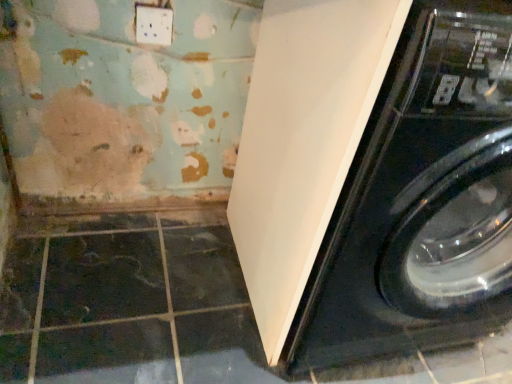
Where is `white plastic electric outlet at upper center`? This screenshot has width=512, height=384. white plastic electric outlet at upper center is located at coordinates (153, 25).

What do you see at coordinates (153, 25) in the screenshot? I see `white plastic electric outlet at upper center` at bounding box center [153, 25].

Locate an element on the screen. This screenshot has height=384, width=512. white glossy washing machine at lower right is located at coordinates (376, 178).

Describe the element at coordinates (376, 178) in the screenshot. I see `white glossy washing machine at lower right` at that location.

The width and height of the screenshot is (512, 384). What are the coordinates of `white plastic electric outlet at upper center` in the screenshot? It's located at (153, 25).

In the image, is white glossy washing machine at lower right on the left side or the right side of white plastic electric outlet at upper center?

white glossy washing machine at lower right is to the right of white plastic electric outlet at upper center.

Considering the positions of objects white glossy washing machine at lower right and white plastic electric outlet at upper center in the image provided, who is behind, white glossy washing machine at lower right or white plastic electric outlet at upper center?

white plastic electric outlet at upper center is further away from the camera.

Is point (282, 287) farther from viewer compared to point (161, 26)?

No, it is in front of (161, 26).

From the image's perspective, is white glossy washing machine at lower right beneath white plastic electric outlet at upper center?

Correct, white glossy washing machine at lower right appears lower than white plastic electric outlet at upper center in the image.

From a real-world perspective, which object rests below the other?

white glossy washing machine at lower right is physically lower.

Between white glossy washing machine at lower right and white plastic electric outlet at upper center, which one has larger width?

white glossy washing machine at lower right is wider.

Consider the image. Considering the sizes of objects white glossy washing machine at lower right and white plastic electric outlet at upper center in the image provided, who is shorter, white glossy washing machine at lower right or white plastic electric outlet at upper center?

With less height is white plastic electric outlet at upper center.

Considering the relative sizes of white glossy washing machine at lower right and white plastic electric outlet at upper center in the image provided, is white glossy washing machine at lower right smaller than white plastic electric outlet at upper center?

Actually, white glossy washing machine at lower right might be larger than white plastic electric outlet at upper center.

Would you say white glossy washing machine at lower right is inside or outside white plastic electric outlet at upper center?

white glossy washing machine at lower right exists outside the volume of white plastic electric outlet at upper center.

Is white glossy washing machine at lower right not close to white plastic electric outlet at upper center?

No, there isn't a large distance between white glossy washing machine at lower right and white plastic electric outlet at upper center.

Could you tell me if white glossy washing machine at lower right is facing white plastic electric outlet at upper center?

No, white glossy washing machine at lower right is not aimed at white plastic electric outlet at upper center.

Consider the image. How different are the orientations of white glossy washing machine at lower right and white plastic electric outlet at upper center in degrees?

The angle between the facing direction of white glossy washing machine at lower right and the facing direction of white plastic electric outlet at upper center is 1.02 degrees.

This screenshot has width=512, height=384. I want to click on electric outlet that is above the white glossy washing machine at lower right (from the image's perspective), so click(x=153, y=25).

Considering the positions of objects white plastic electric outlet at upper center and white glossy washing machine at lower right in the image provided, who is more to the left, white plastic electric outlet at upper center or white glossy washing machine at lower right?

white plastic electric outlet at upper center.

In the image, is white plastic electric outlet at upper center positioned in front of or behind white glossy washing machine at lower right?

Visually, white plastic electric outlet at upper center is located behind white glossy washing machine at lower right.

Does point (147, 9) lie in front of point (357, 221)?

That is False.

From the image's perspective, between white plastic electric outlet at upper center and white glossy washing machine at lower right, which one is located above?

From the image's view, white plastic electric outlet at upper center is above.

From a real-world perspective, is white plastic electric outlet at upper center physically below white glossy washing machine at lower right?

No.

Considering the sizes of white plastic electric outlet at upper center and white glossy washing machine at lower right in the image, is white plastic electric outlet at upper center wider or thinner than white glossy washing machine at lower right?

In the image, white plastic electric outlet at upper center appears to be more narrow than white glossy washing machine at lower right.

Between white plastic electric outlet at upper center and white glossy washing machine at lower right, which one has less height?

white plastic electric outlet at upper center is shorter.

Considering the relative sizes of white plastic electric outlet at upper center and white glossy washing machine at lower right in the image provided, is white plastic electric outlet at upper center bigger than white glossy washing machine at lower right?

Incorrect, white plastic electric outlet at upper center is not larger than white glossy washing machine at lower right.

Can we say white plastic electric outlet at upper center lies outside white glossy washing machine at lower right?

Indeed, white plastic electric outlet at upper center is completely outside white glossy washing machine at lower right.

Is white plastic electric outlet at upper center with white glossy washing machine at lower right?

They are not placed beside each other.

Is white plastic electric outlet at upper center oriented away from white glossy washing machine at lower right?

No, white plastic electric outlet at upper center is not facing away from white glossy washing machine at lower right.

Could you measure the distance between white plastic electric outlet at upper center and white glossy washing machine at lower right?

white plastic electric outlet at upper center and white glossy washing machine at lower right are 26.86 inches apart.

Image resolution: width=512 pixels, height=384 pixels. I want to click on electric outlet positioned vertically above the white glossy washing machine at lower right (from a real-world perspective), so click(x=153, y=25).

The height and width of the screenshot is (384, 512). In the image, there is a white plastic electric outlet at upper center. In order to click on washing machine below it (from the image's perspective) in this screenshot , I will do `click(376, 178)`.

Identify the location of electric outlet that appears above the white glossy washing machine at lower right (from a real-world perspective). (153, 25).